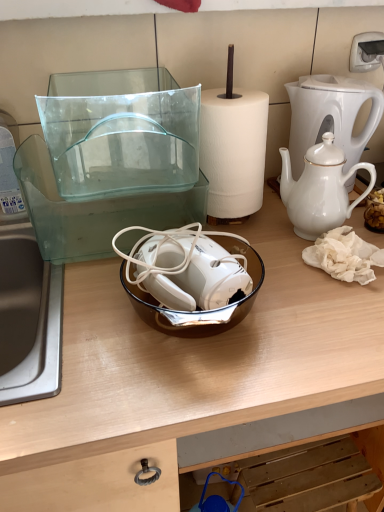
The height and width of the screenshot is (512, 384). What are the coordinates of `vacant space in front of brown glass bowl at center` in the screenshot? It's located at (178, 385).